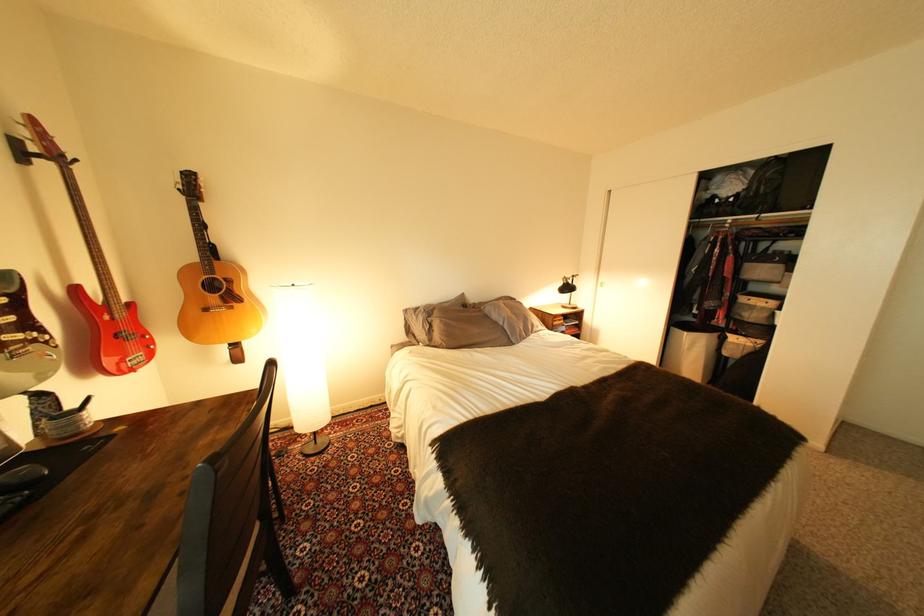
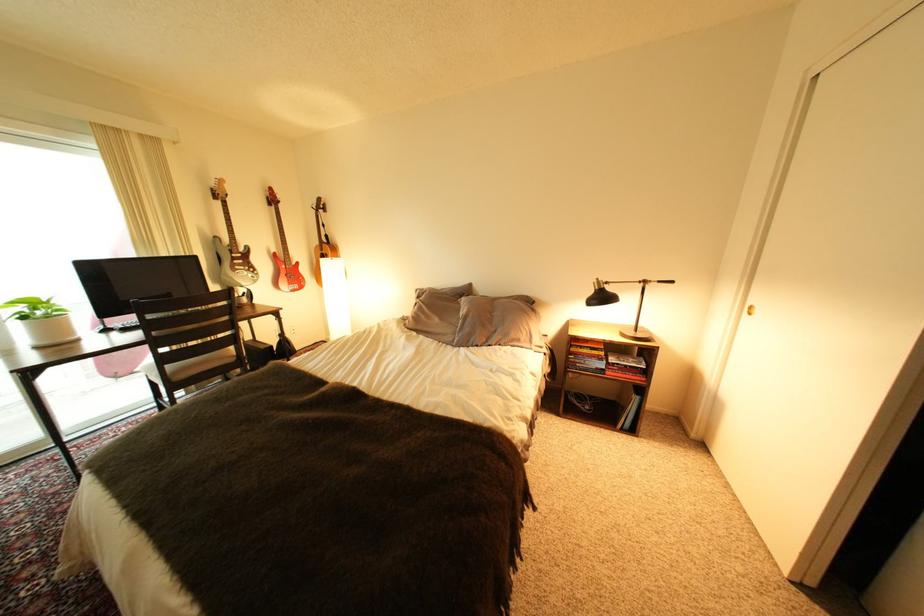
In the second image, find the point that corresponds to pixel 579 292 in the first image.

(608, 304)